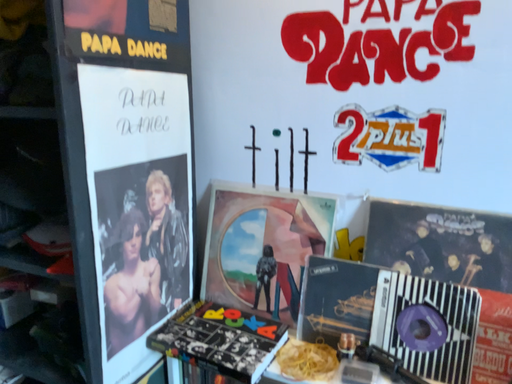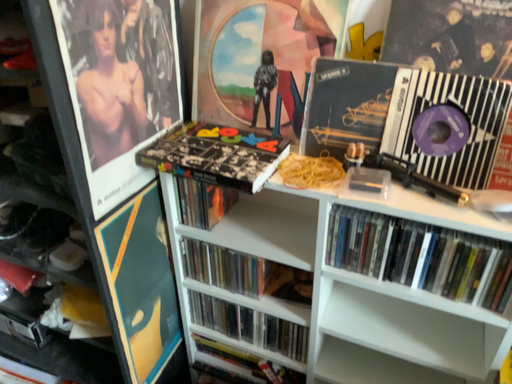
Question: How did the camera likely rotate when shooting the video?

Choices:
 (A) rotated upward
 (B) rotated downward

Answer: (B)